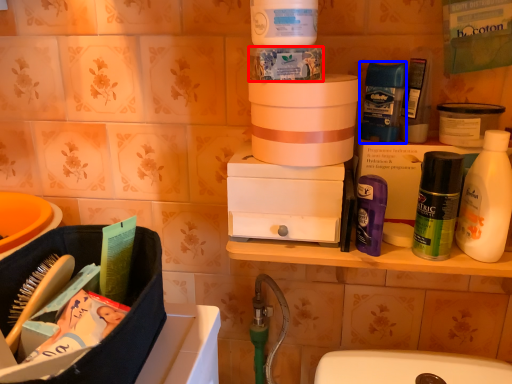
Question: Which object is further to the camera taking this photo, product (highlighted by a red box) or toiletry (highlighted by a blue box)?

Choices:
 (A) product
 (B) toiletry

Answer: (B)